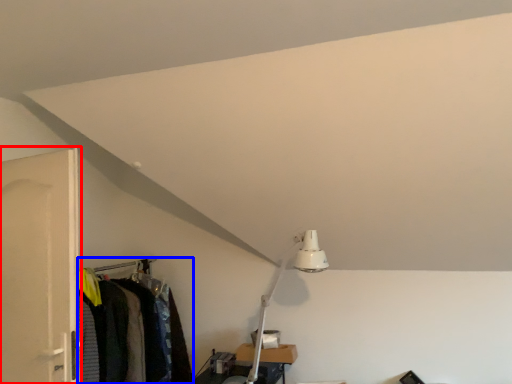
Question: Which object appears farthest to the camera in this image, door (highlighted by a red box) or closet (highlighted by a blue box)?

Choices:
 (A) door
 (B) closet

Answer: (B)